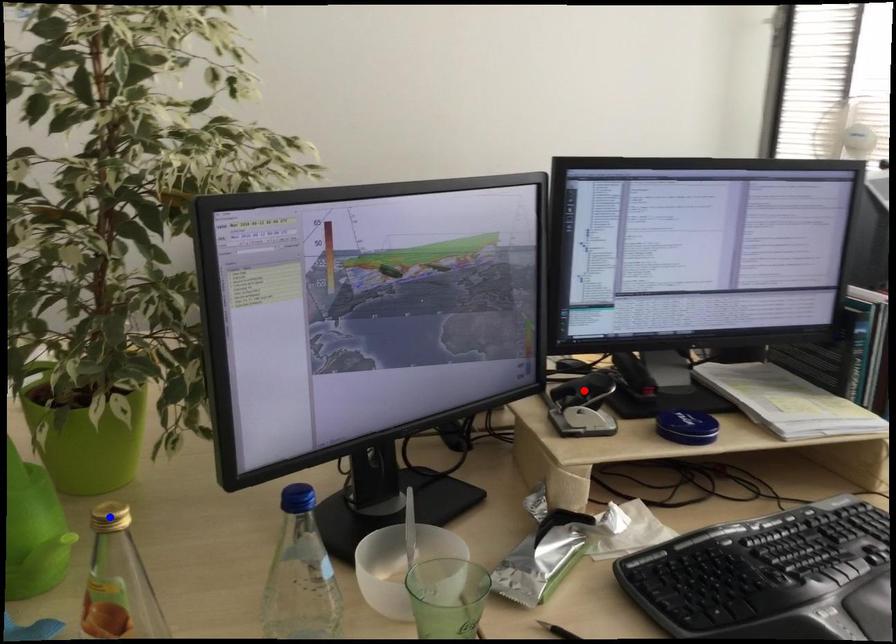
Question: In the image, two points are highlighted. Which point is nearer to the camera? Reply with the corresponding letter.

Choices:
 (A) blue point
 (B) red point

Answer: (A)